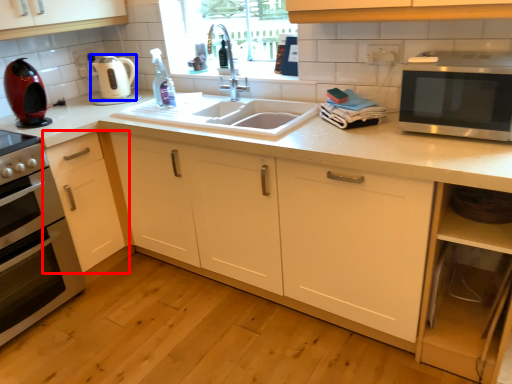
Question: Which object appears farthest to the camera in this image, cabinetry (highlighted by a red box) or appliance (highlighted by a blue box)?

Choices:
 (A) cabinetry
 (B) appliance

Answer: (B)